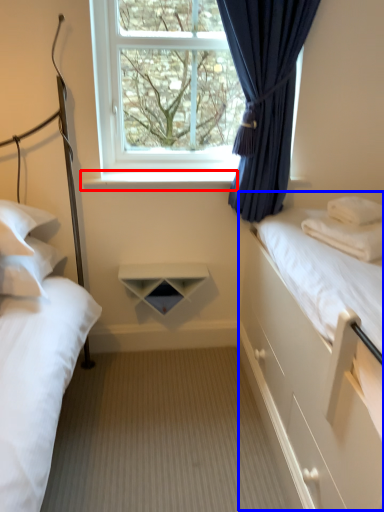
Question: Which object appears closest to the camera in this image, window sill (highlighted by a red box) or bed (highlighted by a blue box)?

Choices:
 (A) window sill
 (B) bed

Answer: (B)